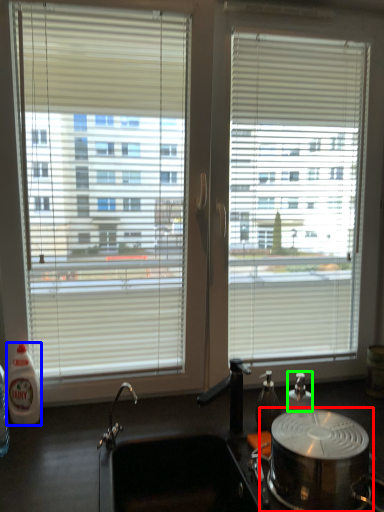
Question: Which object is the farthest from appliance (highlighted by a red box)? Choose among these: bottle (highlighted by a blue box) or bottle (highlighted by a green box).

Choices:
 (A) bottle
 (B) bottle

Answer: (A)